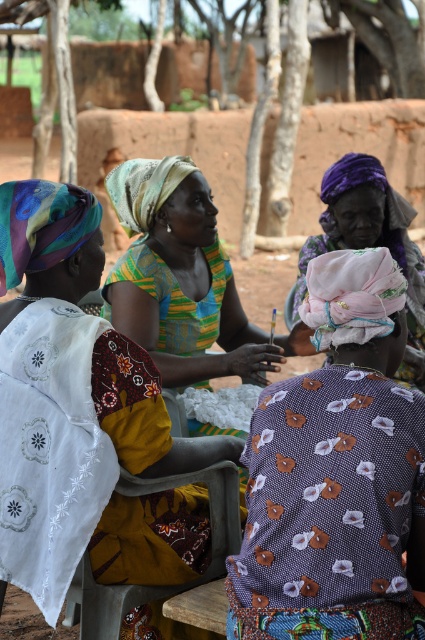
Between embroidered cotton dress at left and purple fabric headscarf at center, which one has more height?

embroidered cotton dress at left is taller.

Which is above, embroidered cotton dress at left or purple fabric headscarf at center?

purple fabric headscarf at center is above.

What do you see at coordinates (48, 243) in the screenshot? This screenshot has height=640, width=425. I see `embroidered cotton dress at left` at bounding box center [48, 243].

The height and width of the screenshot is (640, 425). I want to click on embroidered cotton dress at left, so click(x=48, y=243).

From the picture: Is purple printed fabric at center taller than embroidered cotton dress at left?

No, purple printed fabric at center is not taller than embroidered cotton dress at left.

Locate an element on the screen. This screenshot has height=640, width=425. purple printed fabric at center is located at coordinates (337, 474).

Does purple printed fabric at center appear over purple fabric headscarf at center?

No, purple printed fabric at center is not above purple fabric headscarf at center.

Does point (240, 621) come in front of point (413, 330)?

Yes.

Which is behind, point (356, 260) or point (367, 176)?

Point (367, 176)

Locate an element on the screen. This screenshot has height=640, width=425. purple printed fabric at center is located at coordinates pyautogui.click(x=337, y=474).